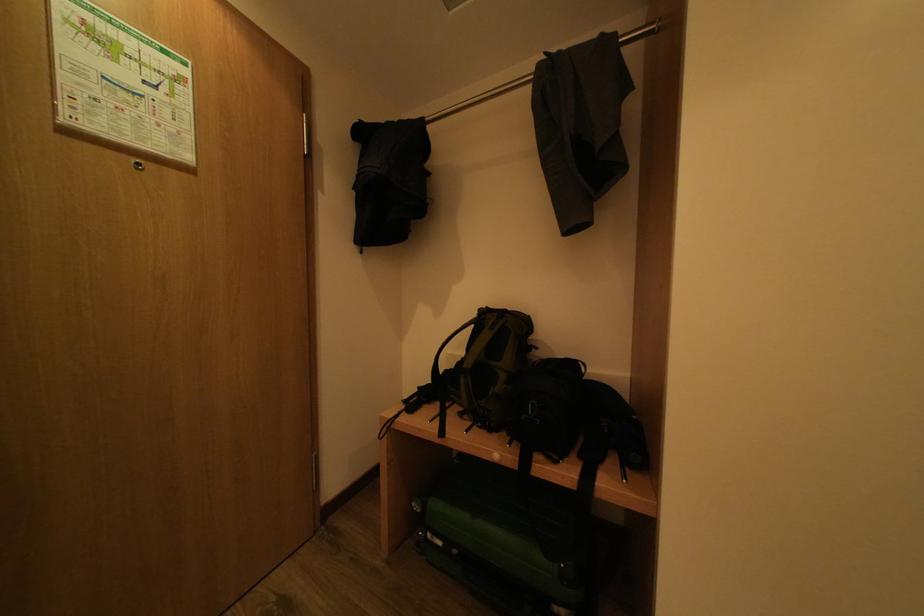
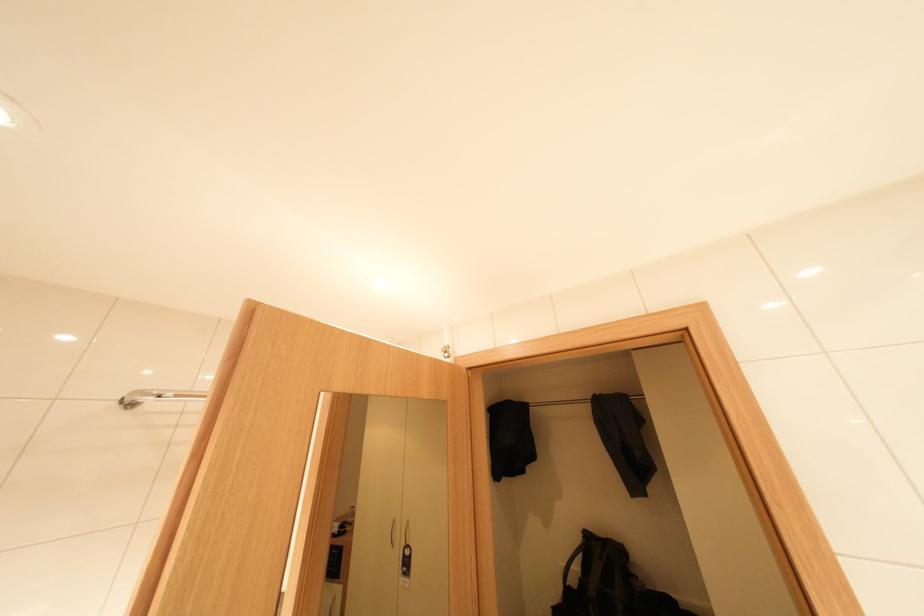
Where in the second image is the point corresponding to (429,387) from the first image?

(563, 609)